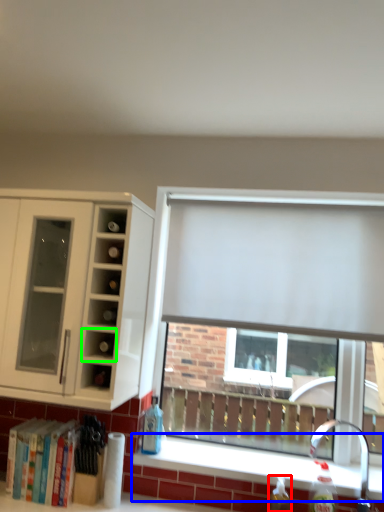
Question: Which is farther away from bottle (highlighted by a red box)? window sill (highlighted by a blue box) or cabinet (highlighted by a green box)?

Choices:
 (A) window sill
 (B) cabinet

Answer: (B)